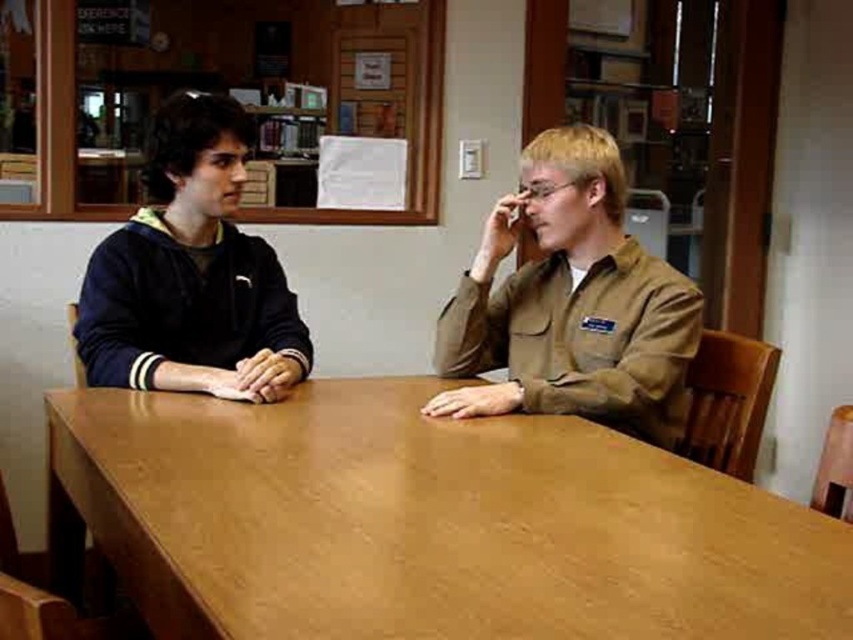
Is brown cotton shirt at right smaller than dark blue fleece at left?

Incorrect, brown cotton shirt at right is not smaller in size than dark blue fleece at left.

Can you confirm if brown cotton shirt at right is wider than dark blue fleece at left?

Indeed, brown cotton shirt at right has a greater width compared to dark blue fleece at left.

Find the location of a particular element. Image resolution: width=853 pixels, height=640 pixels. brown cotton shirt at right is located at coordinates pos(572,301).

Locate an element on the screen. brown cotton shirt at right is located at coordinates (572, 301).

Can you confirm if brown wood table at center is wider than brown cotton shirt at right?

Correct, the width of brown wood table at center exceeds that of brown cotton shirt at right.

Can you confirm if brown wood table at center is bigger than brown cotton shirt at right?

Yes.

Find the location of `brown wood table at center`. brown wood table at center is located at coordinates (422, 524).

In the scene shown: Is brown wood table at center positioned at the back of dark blue fleece at left?

No, it is in front of dark blue fleece at left.

Is point (57, 410) positioned before point (196, 150)?

Yes, it is in front of point (196, 150).

Which is behind, point (734, 536) or point (244, 278)?

The point (244, 278) is behind.

This screenshot has width=853, height=640. Find the location of `brown wood table at center`. brown wood table at center is located at coordinates (422, 524).